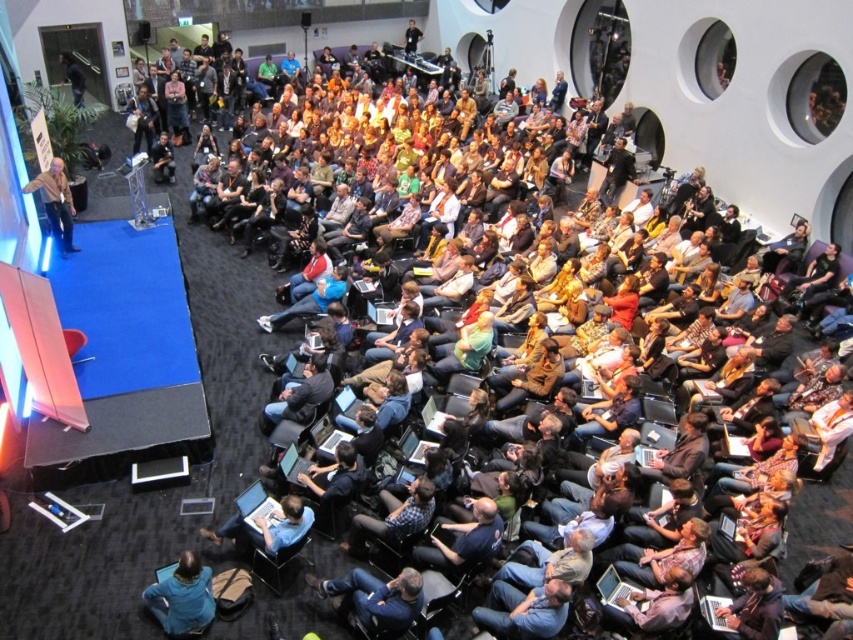
You are an event organizer looking to rearrange the seating. You need to place a new speaker podium between the blue fabric jacket at lower left and the dark brown leather jacket at lower right. Based on their positions, where should the podium be placed relative to these jackets?

The podium should be placed between the blue fabric jacket at lower left and the dark brown leather jacket at lower right, as the blue fabric jacket at lower left is above the dark brown leather jacket at lower right, so the podium can be positioned below the blue fabric jacket at lower left and above the dark brown leather jacket at lower right to sit between them.

From the picture: You are an event organizer standing at the back of the room. You need to hand out a document to both the dark blue shirt at center and the plaid shirt at center. Which person should you approach first based on their proximity to you?

The dark blue shirt at center is closer to the viewer than the plaid shirt at center, so you should approach the dark blue shirt at center first since they are nearer to you.

Consider the image. You are organizing a photo shoot and need to place two jackets for a fashion display. The blue fabric jacket at lower left and the dark brown leather jacket at lower right must be positioned in the conference room. Given that the jackets are currently 4.46 meters apart, can you confirm if there is enough space between them to allow a model to walk comfortably between them?

The blue fabric jacket at lower left and the dark brown leather jacket at lower right are 4.46 meters apart, which provides sufficient space for a model to walk comfortably between them.